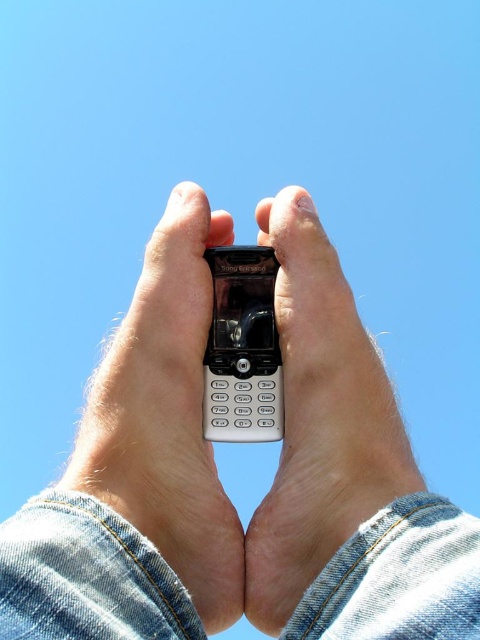
Question: Is white plastic phone at center to the right of matte black phone at center from the viewer's perspective?

Choices:
 (A) no
 (B) yes

Answer: (A)

Question: Which point is closer to the camera?

Choices:
 (A) white plastic phone at center
 (B) matte black phone at center

Answer: (A)

Question: Is white plastic phone at center to the right of matte black phone at center from the viewer's perspective?

Choices:
 (A) yes
 (B) no

Answer: (B)

Question: Is the position of white plastic phone at center less distant than that of matte black phone at center?

Choices:
 (A) yes
 (B) no

Answer: (A)

Question: Which point is closer to the camera taking this photo?

Choices:
 (A) (264, 253)
 (B) (412, 460)

Answer: (B)